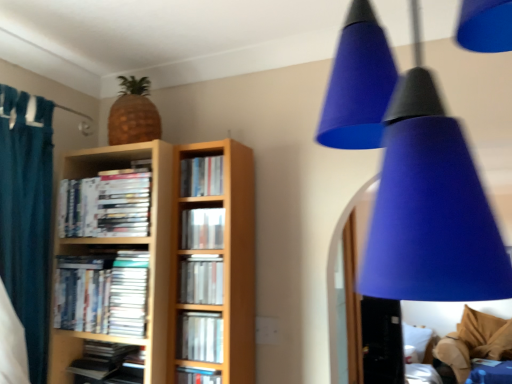
This screenshot has width=512, height=384. Identify the location of white paper at center. (129, 293).

Find the location of a particular element. The width and height of the screenshot is (512, 384). hardcover book at center, the eighth book in the top-to-bottom sequence is located at coordinates (197, 376).

You are a GUI agent. You are given a task and a screenshot of the screen. Output one action in this format:
    pyautogui.click(x=<x>, y=<y>)
    Task: Click on the hardcover books at center, the first book when ordered from top to bottom
    Image resolution: width=512 pixels, height=384 pixels.
    Given the screenshot: What is the action you would take?
    pyautogui.click(x=202, y=176)

What is the approximate width of matte silver book at center, positioned as the fourth book in top-to-bottom order?

The width of matte silver book at center, positioned as the fourth book in top-to-bottom order, is 1.75 inches.

Describe the element at coordinates (200, 336) in the screenshot. I see `matte silver book at center, positioned as the third book in bottom-to-top order` at that location.

Where is `matte plastic books at center left, the fourth book in the bottom-to-top sequence`? matte plastic books at center left, the fourth book in the bottom-to-top sequence is located at coordinates (103, 293).

Locate an element on the screen. white paper at center is located at coordinates (129, 293).

From the image's perspective, is blue matte cone at upper right located beneath matte plastic books at center left, the fourth book in the bottom-to-top sequence?

No, from the image's perspective, blue matte cone at upper right is not below matte plastic books at center left, the fourth book in the bottom-to-top sequence.

Locate an element on the screen. This screenshot has height=384, width=512. the 5th book below the blue matte cone at upper right (from the image's perspective) is located at coordinates (103, 293).

Between blue matte cone at upper right and matte plastic books at center left, the fourth book in the bottom-to-top sequence, which one appears on the right side from the viewer's perspective?

Positioned to the right is blue matte cone at upper right.

From the picture: Can you tell me how much blue matte cone at upper right and matte plastic books at center left, which appears as the fifth book when viewed from the top, differ in facing direction?

The angular difference between blue matte cone at upper right and matte plastic books at center left, which appears as the fifth book when viewed from the top, is 176 degrees.

Is white soft pillow at lower right turned away from blue matte cone at upper right?

No, white soft pillow at lower right is not facing the opposite direction of blue matte cone at upper right.

Between white soft pillow at lower right and blue matte cone at upper right, which one has larger width?

blue matte cone at upper right is wider.

Is white soft pillow at lower right in front of or behind blue matte cone at upper right in the image?

white soft pillow at lower right is positioned farther from the viewer than blue matte cone at upper right.

Which point is more forward, (422, 334) or (487, 212)?

The point (487, 212) is closer.

Which of these two, matte silver book at center, which is the sixth book in top-to-bottom order, or matte silver book at center, which ranks as the 5th book in bottom-to-top order, is smaller?

Smaller between the two is matte silver book at center, which ranks as the 5th book in bottom-to-top order.

Is matte silver book at center, positioned as the third book in bottom-to-top order, turned away from matte silver book at center, positioned as the fourth book in top-to-bottom order?

That's not correct — matte silver book at center, positioned as the third book in bottom-to-top order, is not looking away from matte silver book at center, positioned as the fourth book in top-to-bottom order.

Between matte silver book at center, which is the sixth book in top-to-bottom order, and matte silver book at center, positioned as the fourth book in top-to-bottom order, which one has larger width?

matte silver book at center, which is the sixth book in top-to-bottom order, is wider.

Where is `book that is the 3rd object to the right of the matte silver book at center, which ranks as the 5th book in bottom-to-top order, starting at the anchor`? This screenshot has width=512, height=384. book that is the 3rd object to the right of the matte silver book at center, which ranks as the 5th book in bottom-to-top order, starting at the anchor is located at coordinates click(x=200, y=336).

Considering the relative sizes of matte silver book at center, positioned as the fourth book in top-to-bottom order, and matte plastic books at center left, the fourth book in the bottom-to-top sequence, in the image provided, is matte silver book at center, positioned as the fourth book in top-to-bottom order, bigger than matte plastic books at center left, the fourth book in the bottom-to-top sequence,?

No.

Considering the positions of objects matte silver book at center, which ranks as the 5th book in bottom-to-top order, and matte plastic books at center left, the fourth book in the bottom-to-top sequence, in the image provided, who is in front, matte silver book at center, which ranks as the 5th book in bottom-to-top order, or matte plastic books at center left, the fourth book in the bottom-to-top sequence,?

Positioned in front is matte silver book at center, which ranks as the 5th book in bottom-to-top order.

Is matte plastic books at center left, the fourth book in the bottom-to-top sequence, inside matte silver book at center, positioned as the fourth book in top-to-bottom order?

No, matte plastic books at center left, the fourth book in the bottom-to-top sequence, is not a part of matte silver book at center, positioned as the fourth book in top-to-bottom order.

Could you tell me if matte plastic books at center left, which appears as the fifth book when viewed from the top, is facing matte silver book at center, positioned as the third book in bottom-to-top order?

No, matte plastic books at center left, which appears as the fifth book when viewed from the top, does not turn towards matte silver book at center, positioned as the third book in bottom-to-top order.

What's the angular difference between matte plastic books at center left, which appears as the fifth book when viewed from the top, and matte silver book at center, positioned as the third book in bottom-to-top order,'s facing directions?

The angular difference between matte plastic books at center left, which appears as the fifth book when viewed from the top, and matte silver book at center, positioned as the third book in bottom-to-top order, is 1.44 degrees.

Can you confirm if matte plastic books at center left, which appears as the fifth book when viewed from the top, is taller than matte silver book at center, positioned as the third book in bottom-to-top order?

Yes.

Is matte plastic books at center left, the fourth book in the bottom-to-top sequence, smaller than matte silver book at center, positioned as the third book in bottom-to-top order?

No.

Which object is positioned more to the left, matte plastic book at center, which appears as the sixth book when ordered from the bottom, or wooden bookcase at center?

wooden bookcase at center is more to the left.

Which of these two, matte plastic book at center, which appears as the sixth book when ordered from the bottom, or wooden bookcase at center, stands taller?

Standing taller between the two is wooden bookcase at center.

Does matte plastic book at center, the 3th book when ordered from top to bottom, turn towards wooden bookcase at center?

Yes, matte plastic book at center, the 3th book when ordered from top to bottom, faces towards wooden bookcase at center.

The width and height of the screenshot is (512, 384). Find the location of `bookcase that is in front of the matte plastic book at center, the 3th book when ordered from top to bottom`. bookcase that is in front of the matte plastic book at center, the 3th book when ordered from top to bottom is located at coordinates (168, 263).

From the image's perspective, is white soft pillow at lower right located above or below matte black book at lower left, the second book in the bottom-to-top sequence?

white soft pillow at lower right is situated lower than matte black book at lower left, the second book in the bottom-to-top sequence, in the image.

Is white soft pillow at lower right shorter than matte black book at lower left, the second book in the bottom-to-top sequence?

Incorrect, the height of white soft pillow at lower right does not fall short of that of matte black book at lower left, the second book in the bottom-to-top sequence.

Can you confirm if white soft pillow at lower right is positioned to the left of matte black book at lower left, the second book in the bottom-to-top sequence?

Incorrect, white soft pillow at lower right is not on the left side of matte black book at lower left, the second book in the bottom-to-top sequence.

Locate an element on the screen. The image size is (512, 384). the 7th book counting from the left of the blue matte cone at upper right is located at coordinates (103, 293).

Identify the location of lamp above the white soft pillow at lower right (from a real-world perspective). The image size is (512, 384). (430, 206).

Looking at the image, which one is located further to matte black book at lower left, the second book in the bottom-to-top sequence, wooden bookcase at center or matte plastic book at center, which appears as the sixth book when ordered from the bottom?

matte plastic book at center, which appears as the sixth book when ordered from the bottom, lies further to matte black book at lower left, the second book in the bottom-to-top sequence, than the other object.

Estimate the real-world distances between objects in this image. Which object is further from wooden bookcase at center, white paper at center or white soft pillow at lower right?

The object further to wooden bookcase at center is white soft pillow at lower right.

When comparing their distances from matte plastic book at center, the 3th book when ordered from top to bottom, does matte silver book at center, positioned as the fourth book in top-to-bottom order, or matte plastic books at left, which appears as the second book when viewed from the top, seem closer?

matte silver book at center, positioned as the fourth book in top-to-bottom order, is positioned closer to the anchor matte plastic book at center, the 3th book when ordered from top to bottom.

Estimate the real-world distances between objects in this image. Which object is closer to matte silver book at center, which is the sixth book in top-to-bottom order, white soft pillow at lower right or hardcover books at center, the first book when ordered from top to bottom?

hardcover books at center, the first book when ordered from top to bottom, is closer to matte silver book at center, which is the sixth book in top-to-bottom order.

Estimate the real-world distances between objects in this image. Which object is further from hardcover book at center, positioned as the first book in bottom-to-top order, white soft pillow at lower right or blue matte cone at upper right?

white soft pillow at lower right is positioned further to the anchor hardcover book at center, positioned as the first book in bottom-to-top order.

Based on their spatial positions, is white soft pillow at lower right or matte black book at lower left, placed as the seventh book when sorted from top to bottom, further from matte plastic books at left, which appears as the second book when viewed from the top?

Based on the image, white soft pillow at lower right appears to be further to matte plastic books at left, which appears as the second book when viewed from the top.

Which object lies further to the anchor point hardcover book at center, the eighth book in the top-to-bottom sequence, blue matte cone at upper right or matte silver book at center, which is the sixth book in top-to-bottom order?

blue matte cone at upper right is further to hardcover book at center, the eighth book in the top-to-bottom sequence.

When comparing their distances from hardcover books at center, the first book when ordered from top to bottom, does matte plastic book at center, the 3th book when ordered from top to bottom, or blue matte cone at upper right seem further?

blue matte cone at upper right lies further to hardcover books at center, the first book when ordered from top to bottom, than the other object.

Where is `paperback book that lies between matte plastic book at center, the 3th book when ordered from top to bottom, and matte black book at lower left, the second book in the bottom-to-top sequence, from top to bottom`? paperback book that lies between matte plastic book at center, the 3th book when ordered from top to bottom, and matte black book at lower left, the second book in the bottom-to-top sequence, from top to bottom is located at coordinates (129, 293).

Image resolution: width=512 pixels, height=384 pixels. Identify the location of bookcase between hardcover books at center, which is the 8th book in bottom-to-top order, and matte plastic books at center left, the fourth book in the bottom-to-top sequence, from top to bottom. tap(168, 263).

Where is `paperback book between matte black book at lower left, the second book in the bottom-to-top sequence, and hardcover book at center, positioned as the first book in bottom-to-top order, from left to right`? paperback book between matte black book at lower left, the second book in the bottom-to-top sequence, and hardcover book at center, positioned as the first book in bottom-to-top order, from left to right is located at coordinates (129, 293).

The width and height of the screenshot is (512, 384). I want to click on bookcase between matte plastic book at center, the 3th book when ordered from top to bottom, and matte silver book at center, positioned as the third book in bottom-to-top order, in the vertical direction, so click(168, 263).